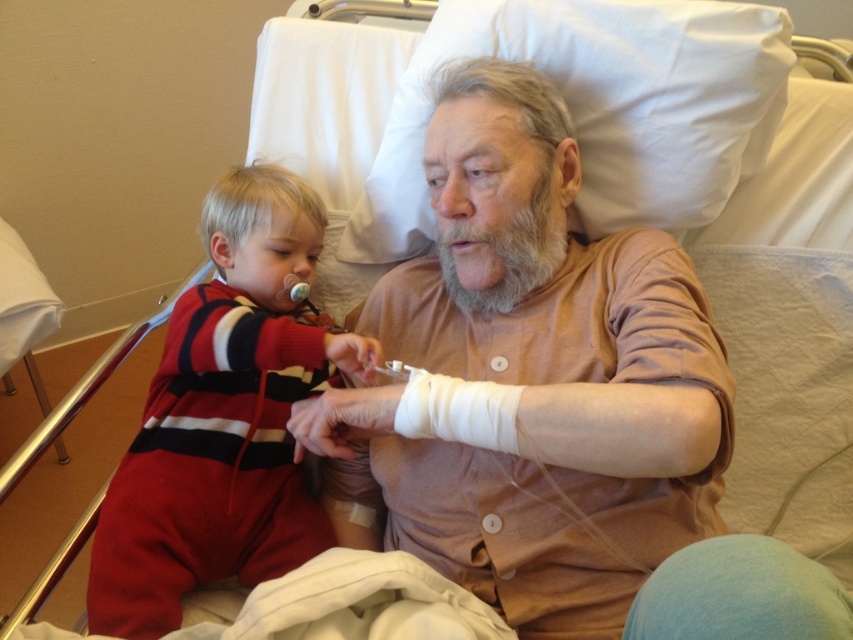
In the scene shown: Is matte brown shirt at center above gray/soft hair at center?

Actually, matte brown shirt at center is below gray/soft hair at center.

Which is in front, point (643, 314) or point (451, 243)?

Point (643, 314) is in front.

The width and height of the screenshot is (853, 640). Identify the location of matte brown shirt at center. (529, 381).

Based on the photo, does matte brown shirt at center have a greater height compared to red striped onesie at left?

Indeed, matte brown shirt at center has a greater height compared to red striped onesie at left.

Which is behind, point (538, 228) or point (167, 579)?

Positioned behind is point (538, 228).

In order to click on matte brown shirt at center in this screenshot , I will do `click(529, 381)`.

Can you confirm if red striped onesie at left is positioned to the left of gray/soft hair at center?

Yes, red striped onesie at left is to the left of gray/soft hair at center.

Does point (322, 540) come in front of point (541, 180)?

No, (322, 540) is behind (541, 180).

Between point (148, 595) and point (476, 240), which one is positioned behind?

The point (476, 240) is behind.

At what (x,y) coordinates should I click in order to perform the action: click on red striped onesie at left. Please return your answer as a coordinate pair (x, y). Looking at the image, I should click on (224, 417).